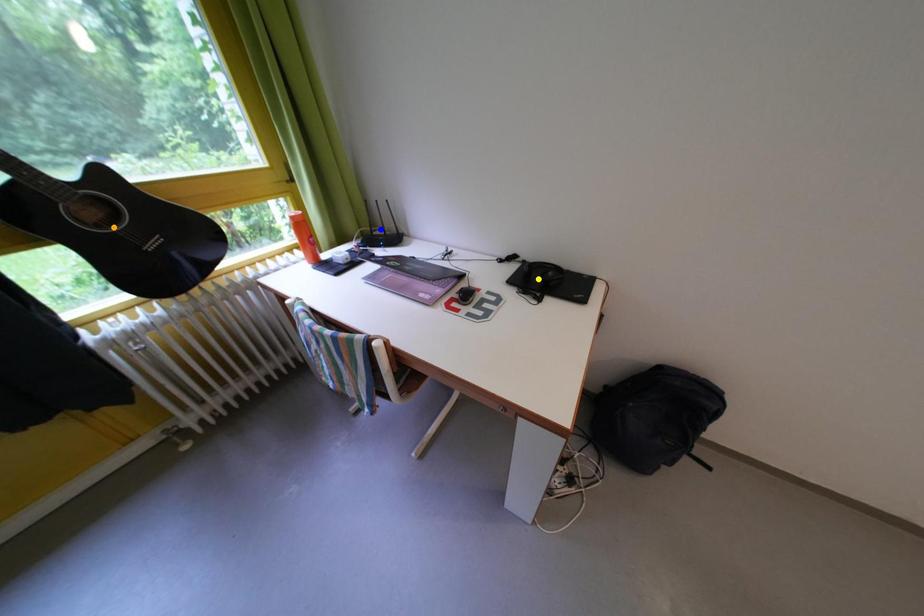
Order these from farthest to nearest:
A) yellow point
B) orange point
C) blue point

blue point → yellow point → orange point